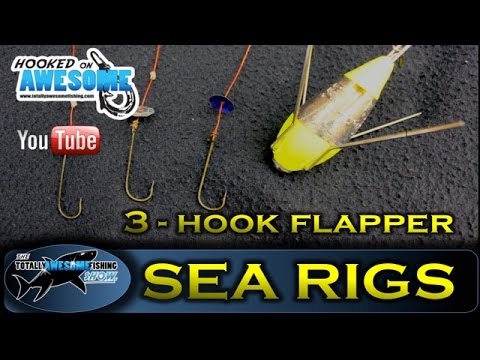
At what (x,y) coordinates should I click in order to perform the action: click on dark gray textured surface. Please return your answer as a coordinate pair (x, y). This screenshot has height=360, width=480. Looking at the image, I should click on (426, 100).